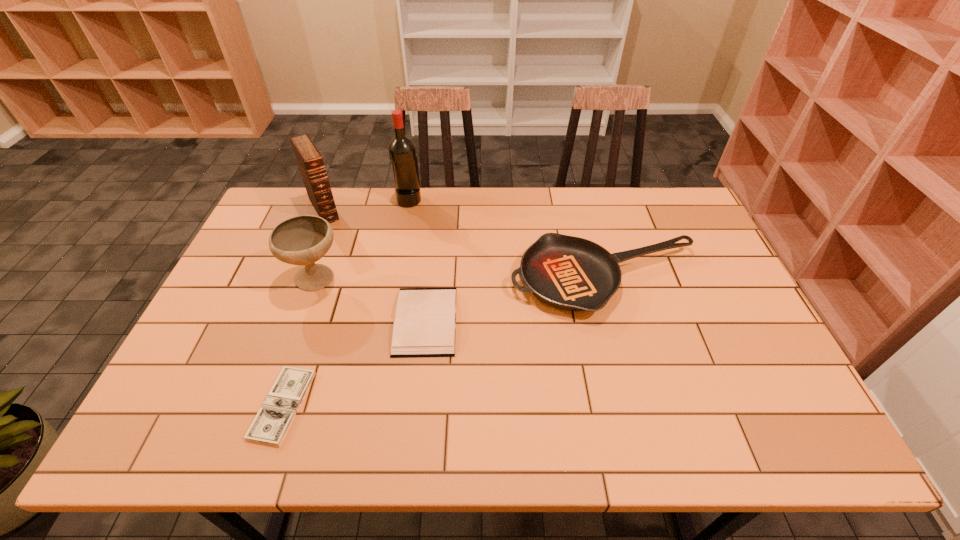
Where is `the tallest object`? The width and height of the screenshot is (960, 540). the tallest object is located at coordinates (402, 152).

This screenshot has width=960, height=540. What are the coordinates of `Bible` in the screenshot? It's located at (309, 159).

At what (x,y) coordinates should I click in order to perform the action: click on the fourth shortest object. Please return your answer as a coordinate pair (x, y). This screenshot has width=960, height=540. Looking at the image, I should click on (301, 240).

Identify the location of frying pan. (570, 273).

Image resolution: width=960 pixels, height=540 pixels. Identify the location of the rightmost object. (570, 273).

This screenshot has width=960, height=540. What are the coordinates of `hardback book` in the screenshot? It's located at (425, 319).

Identify the location of dollar. (270, 425).

Find the location of a particular element. Image resolution: width=960 pixels, height=540 pixels. the nearest object is located at coordinates (270, 425).

The height and width of the screenshot is (540, 960). In order to click on free spot located on the right of the wine bottle in this screenshot , I will do [x=517, y=199].

Where is `vacant region located 0.200m on the right of the second tallest object`? The image size is (960, 540). vacant region located 0.200m on the right of the second tallest object is located at coordinates (401, 210).